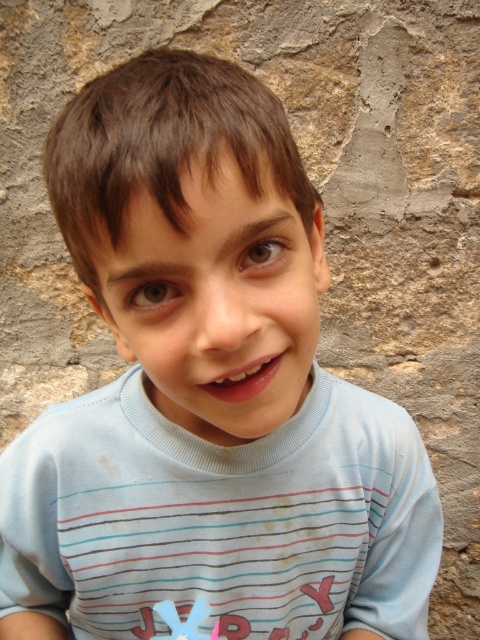
Question: Does light blue cotton shirt at center lie behind pink plastic toy at lower center?

Choices:
 (A) no
 (B) yes

Answer: (B)

Question: Considering the relative positions of light blue cotton shirt at center and pink plastic toy at lower center in the image provided, where is light blue cotton shirt at center located with respect to pink plastic toy at lower center?

Choices:
 (A) right
 (B) left

Answer: (A)

Question: Among these points, which one is nearest to the camera?

Choices:
 (A) (206, 612)
 (B) (23, 563)

Answer: (A)

Question: Which point is farther to the camera?

Choices:
 (A) pink plastic toy at lower center
 (B) light blue cotton shirt at center

Answer: (B)

Question: Which point is closer to the camera taking this photo?

Choices:
 (A) (6, 500)
 (B) (192, 614)

Answer: (B)

Question: Does light blue cotton shirt at center have a greater width compared to pink plastic toy at lower center?

Choices:
 (A) no
 (B) yes

Answer: (B)